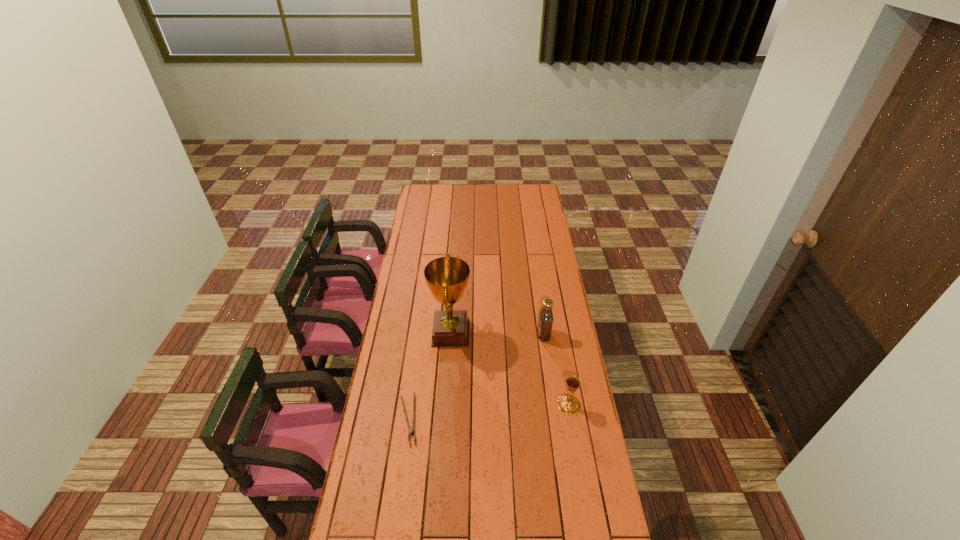
The image size is (960, 540). I want to click on vacant space that's between the third shortest object and the shortest object, so click(x=476, y=377).

At what (x,y) coordinates should I click in order to perform the action: click on free space between the third tallest object and the tallest object. Please return your answer as a coordinate pair (x, y). This screenshot has height=540, width=960. Looking at the image, I should click on (510, 369).

This screenshot has height=540, width=960. What are the coordinates of `free space between the vodka and the second shortest object` in the screenshot? It's located at (556, 369).

Identify the location of free space between the shortest object and the second tallest object. (476, 377).

The height and width of the screenshot is (540, 960). What are the coordinates of `free point between the third tallest object and the vodka` in the screenshot? It's located at (556, 369).

Where is `free space that is in between the vodka and the tallest object`? free space that is in between the vodka and the tallest object is located at coordinates (497, 334).

In order to click on unoccupied position between the vodka and the leftmost object in this screenshot , I will do `click(476, 377)`.

Where is `free space between the award and the vodka`? The height and width of the screenshot is (540, 960). free space between the award and the vodka is located at coordinates (497, 334).

The image size is (960, 540). What are the coordinates of `vacant space that is in between the second shortest object and the second object from left to right` in the screenshot? It's located at (510, 369).

Locate an element on the screen. Image resolution: width=960 pixels, height=540 pixels. object that is the second closest to the tallest object is located at coordinates (545, 322).